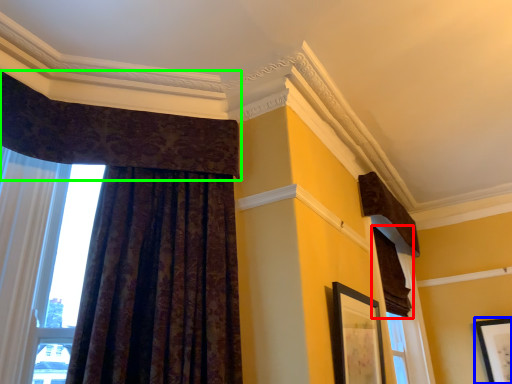
Question: Based on their relative distances, which object is nearer to curtain (highlighted by a red box)? Choose from picture frame (highlighted by a blue box) and curtain (highlighted by a green box).

Choices:
 (A) picture frame
 (B) curtain

Answer: (A)